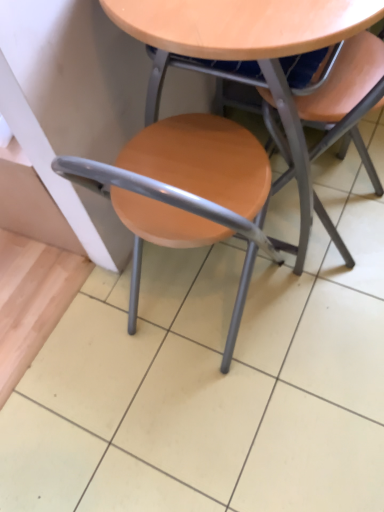
What do you see at coordinates (347, 98) in the screenshot? The height and width of the screenshot is (512, 384). I see `matte wood chair at center` at bounding box center [347, 98].

What is the approximate height of matte wood chair at center?

30.13 inches.

Where is `matte wood chair at center`? Image resolution: width=384 pixels, height=512 pixels. matte wood chair at center is located at coordinates (347, 98).

Identify the location of matte wood chair at center. (347, 98).